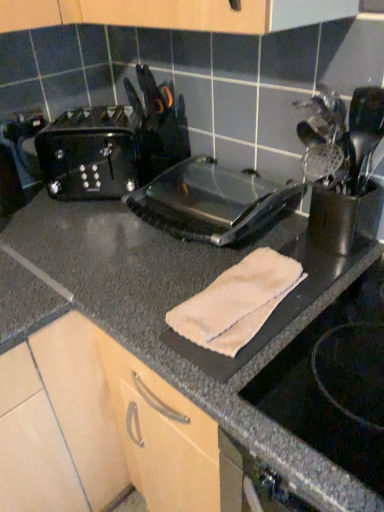
You are a GUI agent. You are given a task and a screenshot of the screen. Output one action in this format:
    pyautogui.click(x=<x>, y=<y>)
    Task: Click on the free space above beige cotton towel at center (from a real-world perspective)
    
    Given the screenshot: What is the action you would take?
    pyautogui.click(x=238, y=286)